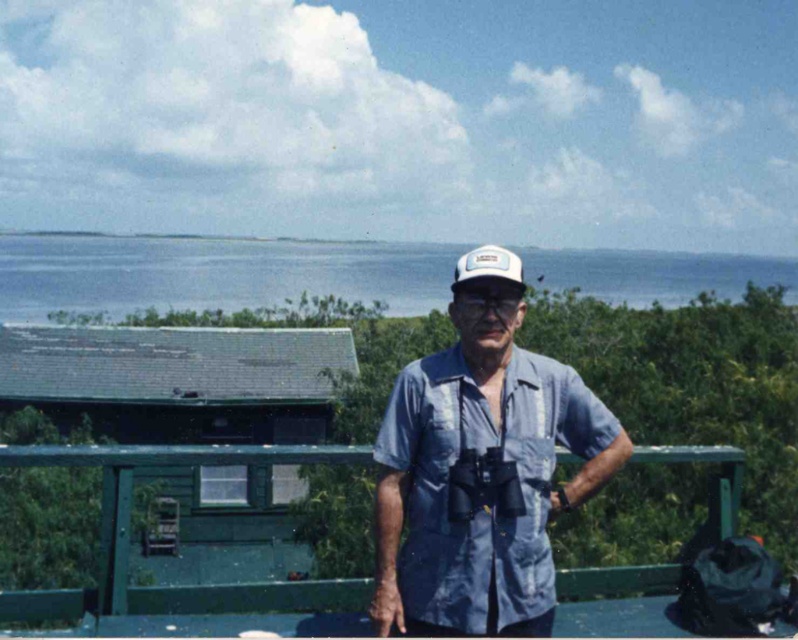
Is blue denim shirt at center further to the viewer compared to green painted wood at center?

No.

Who is more forward, (591, 403) or (561, 580)?

Point (591, 403) is in front.

Locate an element on the screen. The image size is (798, 640). blue denim shirt at center is located at coordinates (480, 476).

Does green painted wood at center have a lesser height compared to white mesh cap at center?

No, green painted wood at center is not shorter than white mesh cap at center.

Who is more distant from viewer, (741, 476) or (504, 260)?

Point (741, 476)

Find the location of a particular element. This screenshot has height=640, width=798. green painted wood at center is located at coordinates (128, 536).

Measure the distance between blue denim shirt at center and white mesh cap at center.

blue denim shirt at center and white mesh cap at center are 20.89 inches apart.

Can you confirm if blue denim shirt at center is smaller than white mesh cap at center?

No.

Does point (389, 586) lie in front of point (500, 250)?

Yes, point (389, 586) is in front of point (500, 250).

The width and height of the screenshot is (798, 640). In order to click on blue denim shirt at center in this screenshot , I will do `click(480, 476)`.